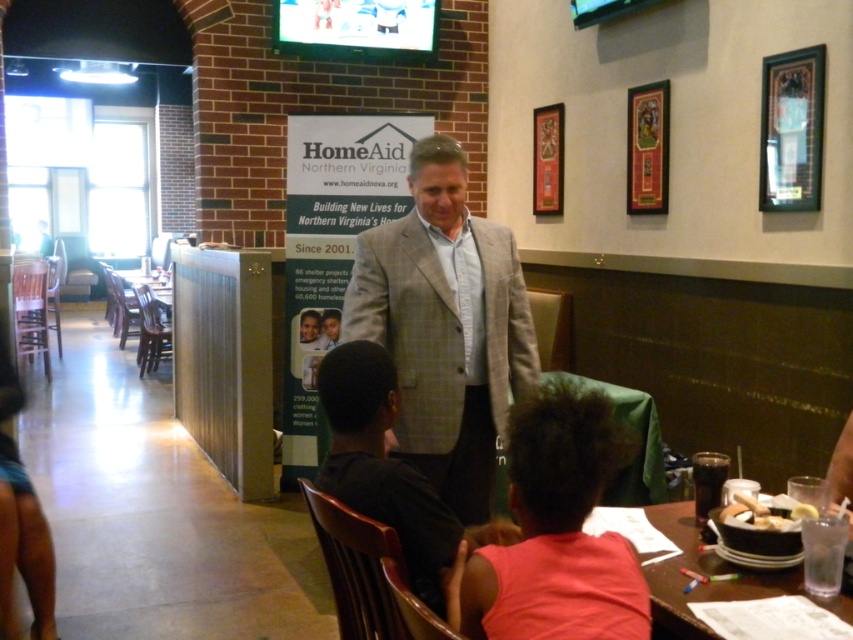
Which of these two, gray plaid suit at center or clear plastic table at lower right, stands shorter?

clear plastic table at lower right

Between gray plaid suit at center and clear plastic table at lower right, which one appears on the left side from the viewer's perspective?

gray plaid suit at center is more to the left.

Does point (374, 278) lie behind point (660, 609)?

Yes, it is.

You are a GUI agent. You are given a task and a screenshot of the screen. Output one action in this format:
    pyautogui.click(x=<x>, y=<y>)
    Task: Click on the gray plaid suit at center
    The image size is (853, 640).
    Given the screenshot: What is the action you would take?
    pyautogui.click(x=445, y=326)

Does point (463, 403) come behind point (618, 545)?

Yes, point (463, 403) is behind point (618, 545).

The width and height of the screenshot is (853, 640). What are the coordinates of `gray plaid suit at center` in the screenshot? It's located at (445, 326).

I want to click on gray plaid suit at center, so 445,326.

This screenshot has width=853, height=640. What are the coordinates of `gray plaid suit at center` in the screenshot? It's located at (445, 326).

Is pink fabric at lower center further to the viewer compared to clear plastic table at lower right?

No, it is in front of clear plastic table at lower right.

Is pink fabric at lower center positioned in front of clear plastic table at lower right?

Yes, pink fabric at lower center is in front of clear plastic table at lower right.

Is point (505, 561) positioned before point (718, 586)?

Yes, it is.

Find the location of a particular element. pink fabric at lower center is located at coordinates (556, 531).